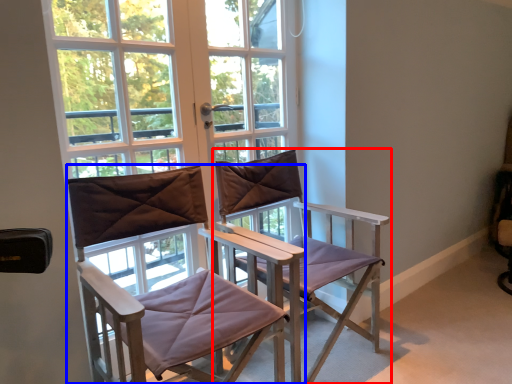
Question: Which point is closer to the camera, chair (highlighted by a red box) or chair (highlighted by a blue box)?

Choices:
 (A) chair
 (B) chair

Answer: (B)